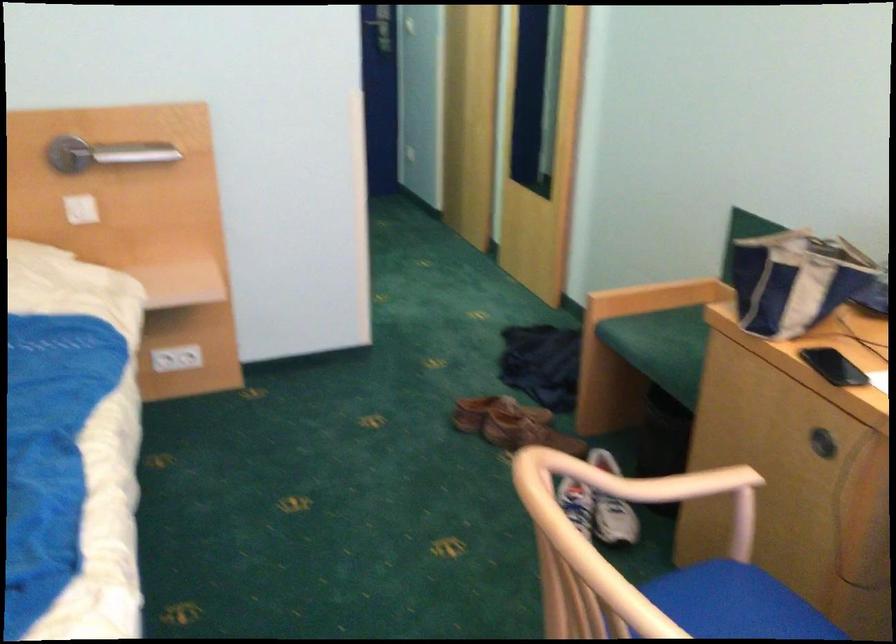
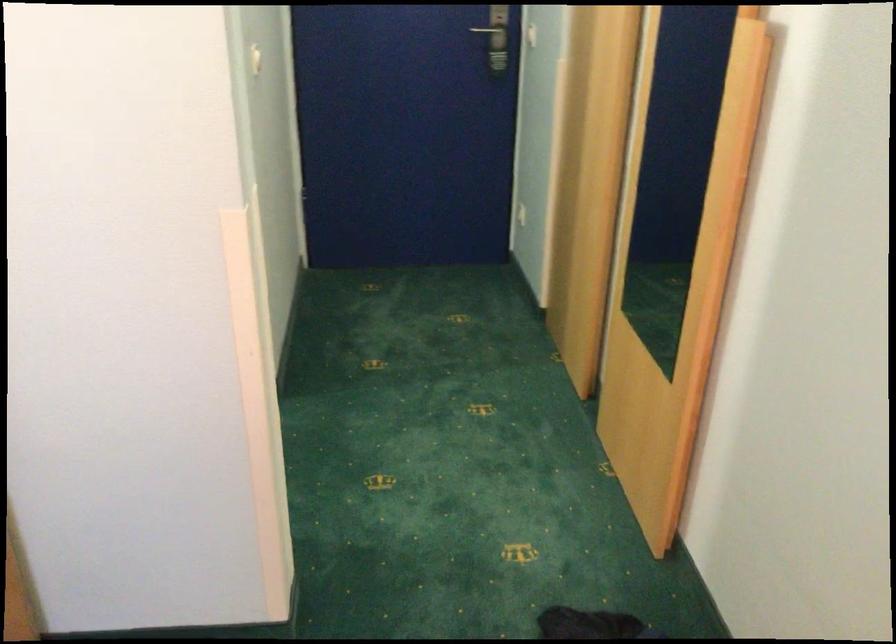
Question: Which direction would the cameraman need to move to produce the second image? Reply with the corresponding letter.

Choices:
 (A) Left
 (B) Right
 (C) Forward
 (D) Backward

Answer: (C)